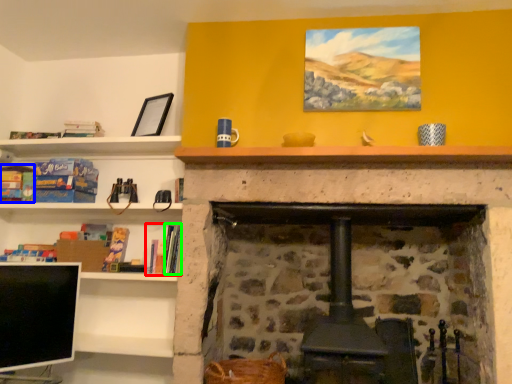
Question: Estimate the real-world distances between objects in this image. Which object is closer to book (highlighted by a red box), book (highlighted by a blue box) or book (highlighted by a green box)?

Choices:
 (A) book
 (B) book

Answer: (B)